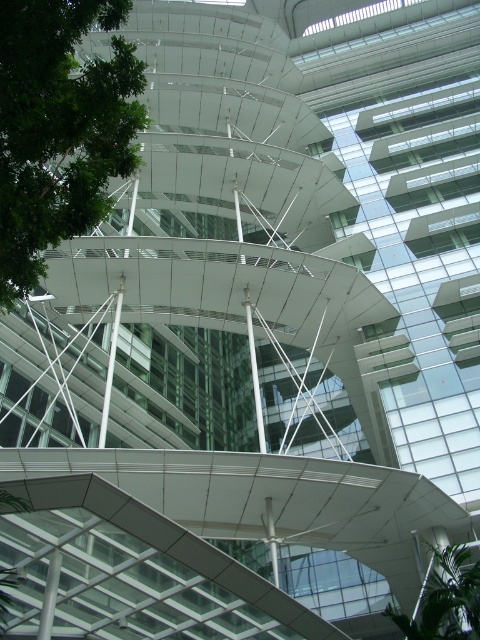
Who is lower down, green leafy tree at upper left or green leafy tree at lower right?

green leafy tree at lower right is lower down.

Is point (27, 33) positioned in front of point (474, 570)?

That is True.

Between point (84, 26) and point (474, 577), which one is positioned in front?

Positioned in front is point (84, 26).

Image resolution: width=480 pixels, height=640 pixels. Find the location of `green leafy tree at upper left`. green leafy tree at upper left is located at coordinates (60, 129).